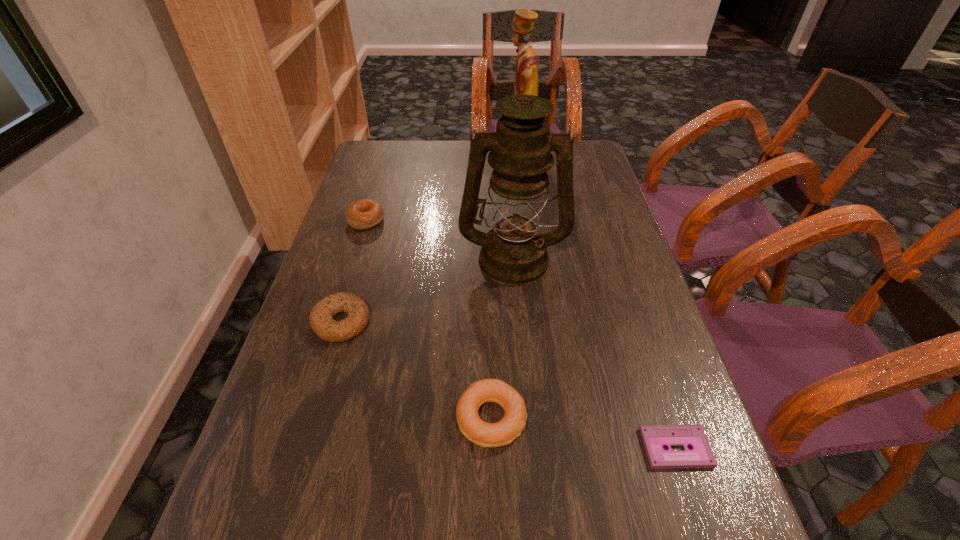
Where is `nutcracker`? This screenshot has width=960, height=540. nutcracker is located at coordinates (526, 80).

Identify the location of oil lamp. This screenshot has height=540, width=960. (514, 252).

Where is `the second farthest object`? the second farthest object is located at coordinates [x=363, y=214].

This screenshot has width=960, height=540. Find the location of `the rightmost bagel`. the rightmost bagel is located at coordinates (504, 432).

The width and height of the screenshot is (960, 540). I want to click on the fourth farthest object, so click(321, 320).

At what (x,y) coordinates should I click in order to perform the action: click on videotape. Please return your answer as a coordinate pair (x, y). Image resolution: width=960 pixels, height=540 pixels. Looking at the image, I should click on (655, 437).

Identify the location of the rightmost object. The height and width of the screenshot is (540, 960). (655, 437).

Locate an element on the screen. Image resolution: width=960 pixels, height=540 pixels. free location located 0.130m on the front-facing side of the nutcracker is located at coordinates (464, 164).

The image size is (960, 540). I want to click on free space located on the front-facing side of the nutcracker, so click(x=433, y=164).

Where is `vacant space located 0.360m on the front-facing side of the nutcracker`? The image size is (960, 540). vacant space located 0.360m on the front-facing side of the nutcracker is located at coordinates (x=394, y=164).